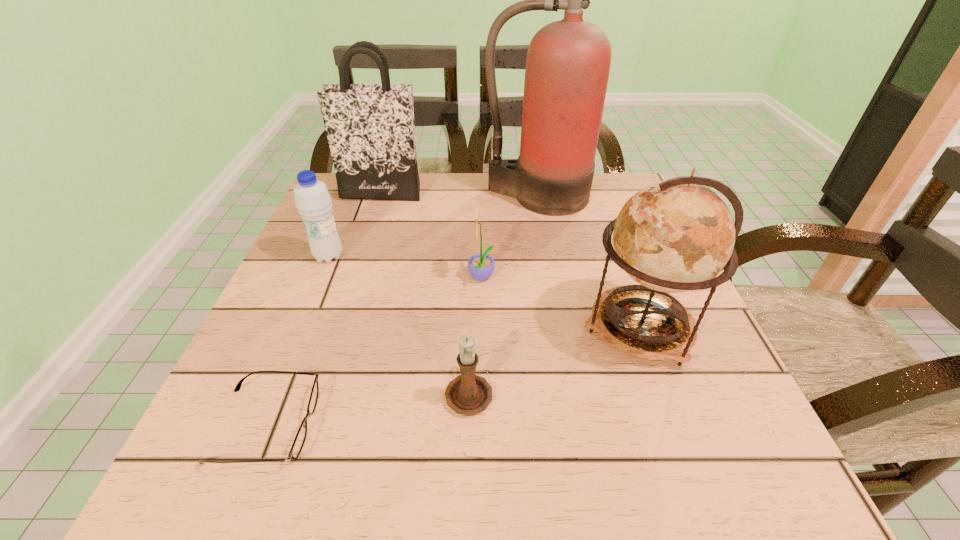
Locate an element on the screen. Image resolution: width=960 pixels, height=540 pixels. vacant point located 0.380m on the front-facing side of the spectacles is located at coordinates (567, 425).

At what (x,y) coordinates should I click in order to perform the action: click on fire extinguisher that is at the far edge. Please return your answer as a coordinate pair (x, y). Looking at the image, I should click on (568, 62).

The image size is (960, 540). Identify the location of shopping bag present at the far edge. (370, 128).

Image resolution: width=960 pixels, height=540 pixels. I want to click on object situated at the near edge, so click(300, 437).

Find the location of a particular element. The width and height of the screenshot is (960, 540). shopping bag at the left edge is located at coordinates (370, 128).

The width and height of the screenshot is (960, 540). I want to click on water bottle that is at the left edge, so click(x=312, y=199).

At what (x,y) coordinates should I click in order to perform the action: click on spectacles located in the left edge section of the desktop. Please return your answer as a coordinate pair (x, y). Looking at the image, I should click on (300, 437).

This screenshot has width=960, height=540. Identify the location of fire extinguisher positioned at the right edge. (568, 62).

You are a GUI agent. You are given a task and a screenshot of the screen. Output one action in this format:
    pyautogui.click(x=<x>, y=<y>)
    Task: Click on the globe at the right edge
    The image size is (960, 540).
    Given the screenshot: What is the action you would take?
    pyautogui.click(x=676, y=235)

Identify the location of object at the far left corner. (370, 128).